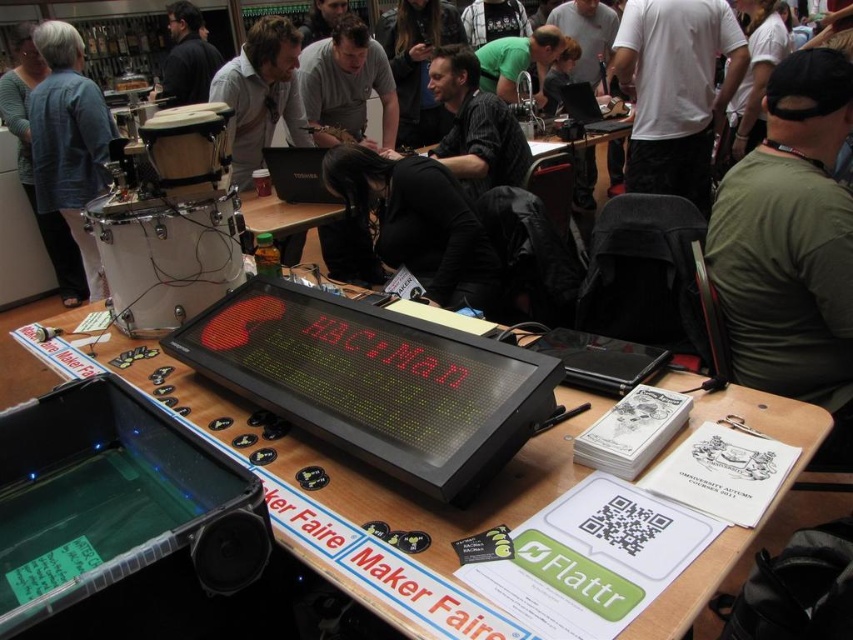
Which of these two, gray matte shirt at center or green shirt at center, stands shorter?

green shirt at center is shorter.

Who is taller, gray matte shirt at center or green shirt at center?

With more height is gray matte shirt at center.

Does point (352, 122) come in front of point (511, 67)?

Yes, it is in front of point (511, 67).

Where is `gray matte shirt at center`? gray matte shirt at center is located at coordinates (346, 84).

Can you confirm if black matte shirt at center is bigger than black plastic speaker at lower left?

Yes, black matte shirt at center is bigger than black plastic speaker at lower left.

Does black matte shirt at center have a greater width compared to black plastic speaker at lower left?

Correct, the width of black matte shirt at center exceeds that of black plastic speaker at lower left.

Locate an element on the screen. This screenshot has height=640, width=853. black matte shirt at center is located at coordinates (x=416, y=221).

Image resolution: width=853 pixels, height=640 pixels. I want to click on black matte shirt at center, so click(416, 221).

Which of these two, black matte shirt at center or light brown leather jacket at upper center, stands shorter?

black matte shirt at center is shorter.

Does black matte shirt at center have a larger size compared to light brown leather jacket at upper center?

Correct, black matte shirt at center is larger in size than light brown leather jacket at upper center.

Identify the location of black matte shirt at center. (416, 221).